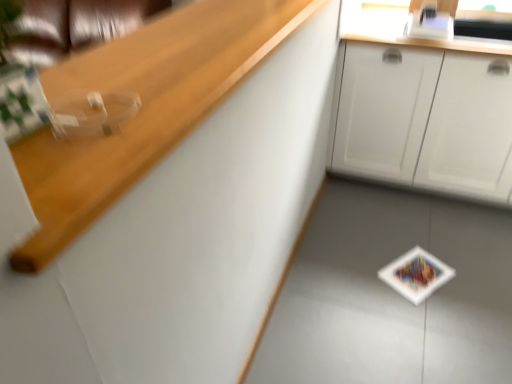
Question: Looking at the image, does white matte cabinet at upper right seem bigger or smaller compared to wooden at upper left?

Choices:
 (A) big
 (B) small

Answer: (A)

Question: Looking at their shapes, would you say white matte cabinet at upper right is wider or thinner than wooden at upper left?

Choices:
 (A) thin
 (B) wide

Answer: (B)

Question: Considering the positions of white matte cabinet at upper right and wooden at upper left in the image, is white matte cabinet at upper right taller or shorter than wooden at upper left?

Choices:
 (A) tall
 (B) short

Answer: (A)

Question: From a real-world perspective, is wooden at upper left positioned above or below white matte cabinet at upper right?

Choices:
 (A) above
 (B) below

Answer: (A)

Question: Considering the positions of wooden at upper left and white matte cabinet at upper right in the image, is wooden at upper left wider or thinner than white matte cabinet at upper right?

Choices:
 (A) wide
 (B) thin

Answer: (B)

Question: Is wooden at upper left in front of or behind white matte cabinet at upper right in the image?

Choices:
 (A) behind
 (B) front

Answer: (B)

Question: Based on their positions, is wooden at upper left located to the left or right of white matte cabinet at upper right?

Choices:
 (A) left
 (B) right

Answer: (A)